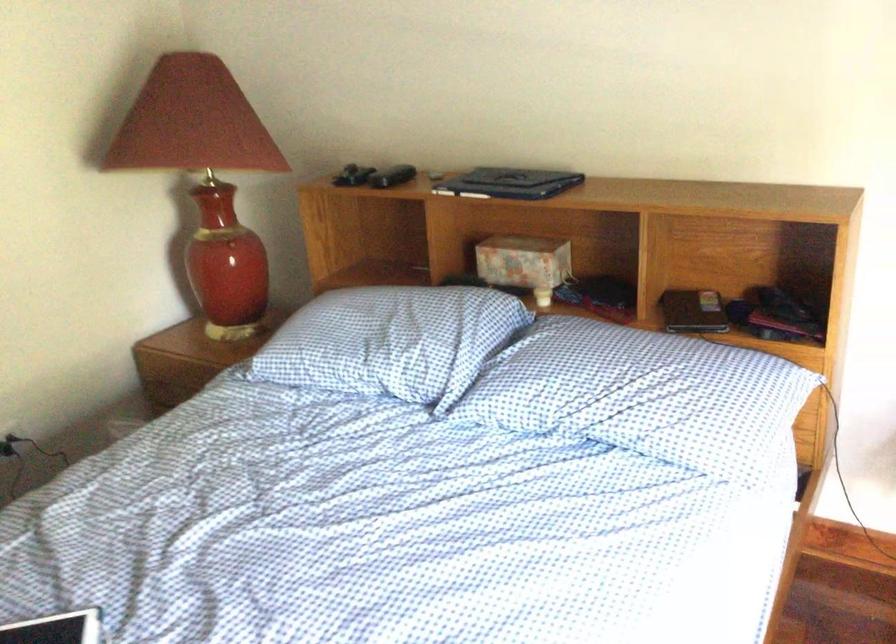
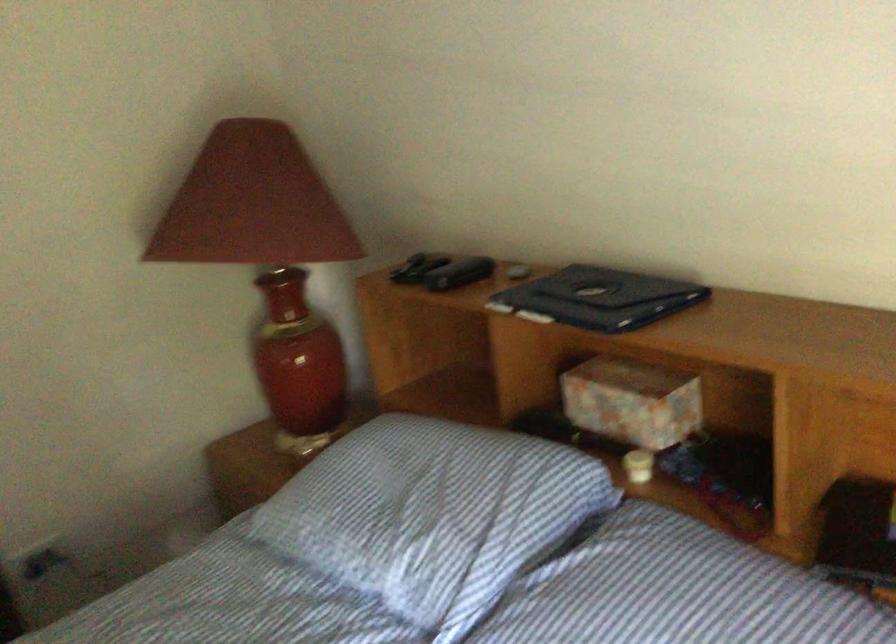
Question: The camera is either moving clockwise (left) or counter-clockwise (right) around the object. The first image is from the beginning of the video and the second image is from the end. Is the camera moving left or right when shooting the video?

Choices:
 (A) Left
 (B) Right

Answer: (B)